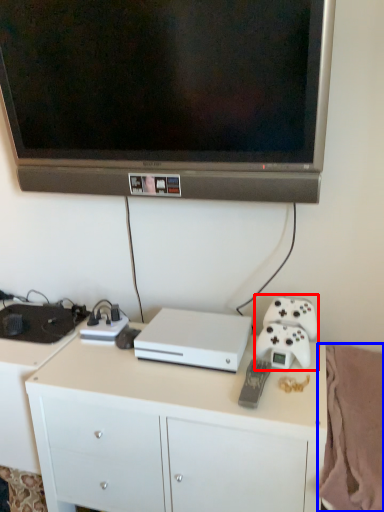
Question: Among these objects, which one is nearest to the camera, game controller (highlighted by a red box) or blanket (highlighted by a blue box)?

Choices:
 (A) game controller
 (B) blanket

Answer: (B)